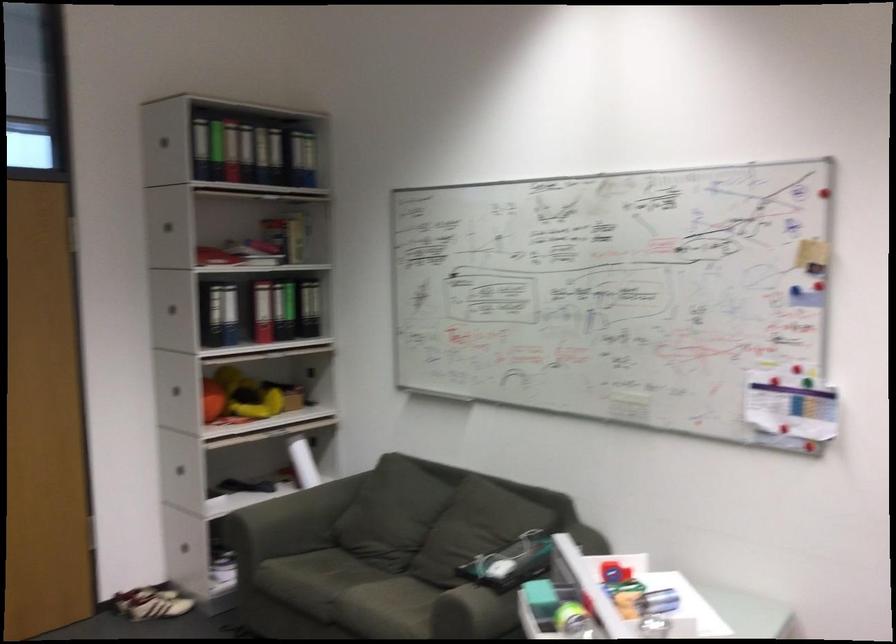
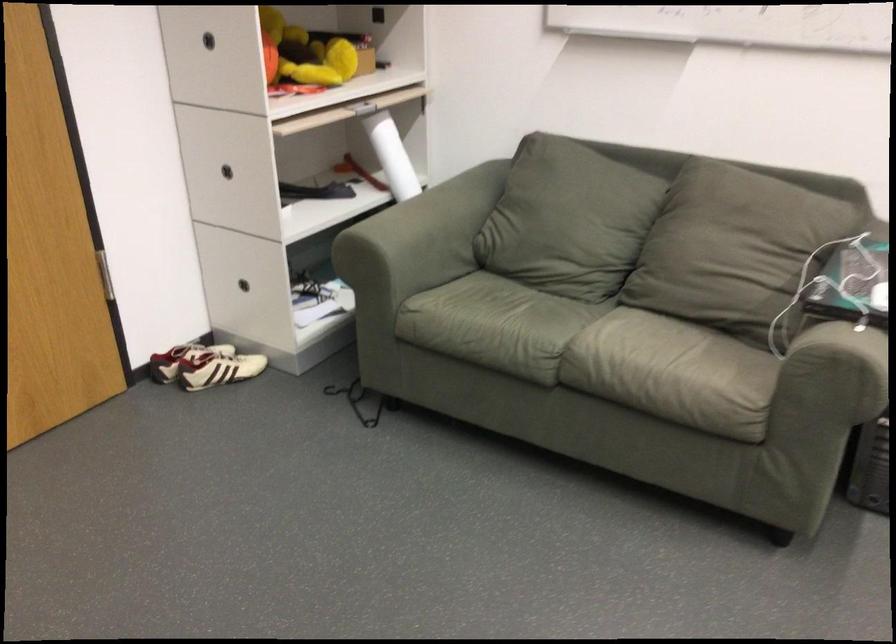
Locate, in the second image, the point that corresponds to (x=460, y=547) in the first image.

(728, 243)